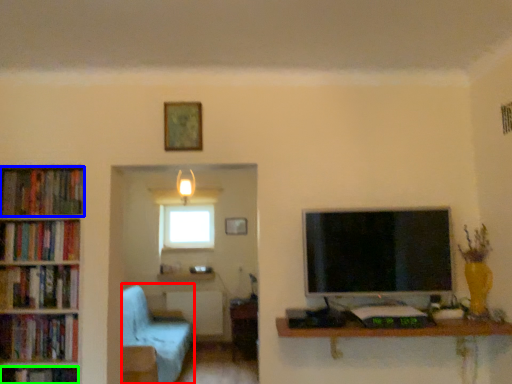
Question: Considering the real-world distances, which object is closest to armchair (highlighted by a red box)? book (highlighted by a blue box) or book (highlighted by a green box).

Choices:
 (A) book
 (B) book

Answer: (B)